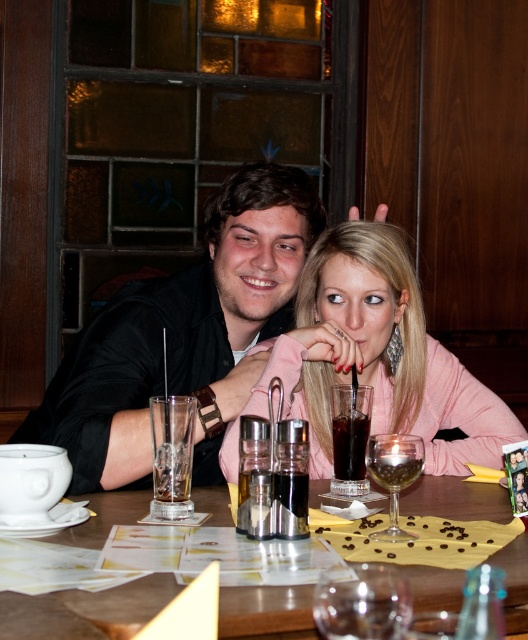
You are a server at the restaurant and need to place a new menu on the table. The menu is 12 inches wide. Can you fit it on the translucent glass table at center without overlapping the transparent glass wine glass at center?

The translucent glass table at center is closer to the viewer than the transparent glass wine glass at center, so the menu can be placed on the table without overlapping the wine glass since the table is in front of the glass.

You are a server in a restaurant and need to place a new order on the table. There is a transparent glass wine glass at center and a clear glass wine at center. Which one should you use to pour red wine?

The transparent glass wine glass at center is shorter than the clear glass wine at center. Therefore, you should use the transparent glass wine glass at center to pour red wine because it is the appropriate glass for the wine, while the taller one might be for other beverages.

You are a server in a restaurant and need to place a new drink order on the table. The customer requested it to be placed to the right of the transparent glass wine glass at center. Where should you place the new drink order relative to the translucent glass table at center?

The new drink order should be placed to the right of the transparent glass wine glass at center, which is to the right of the translucent glass table at center. Therefore, the drink should be placed to the right of the translucent glass table at center.